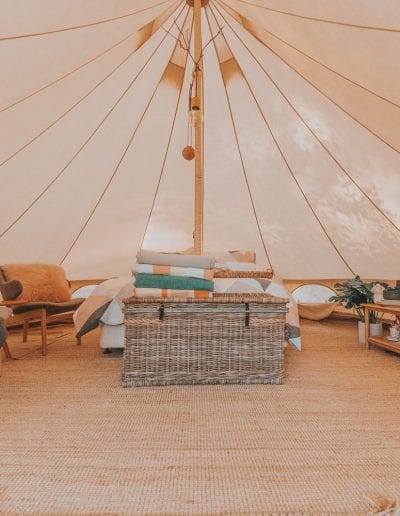
You are a GUI agent. You are given a task and a screenshot of the screen. Output one action in this format:
    pyautogui.click(x=<x>, y=<y>)
    Task: Click on the folded cloth
    The width and height of the screenshot is (400, 516).
    Given the screenshot: What is the action you would take?
    pyautogui.click(x=169, y=259), pyautogui.click(x=175, y=270), pyautogui.click(x=166, y=280), pyautogui.click(x=166, y=292)